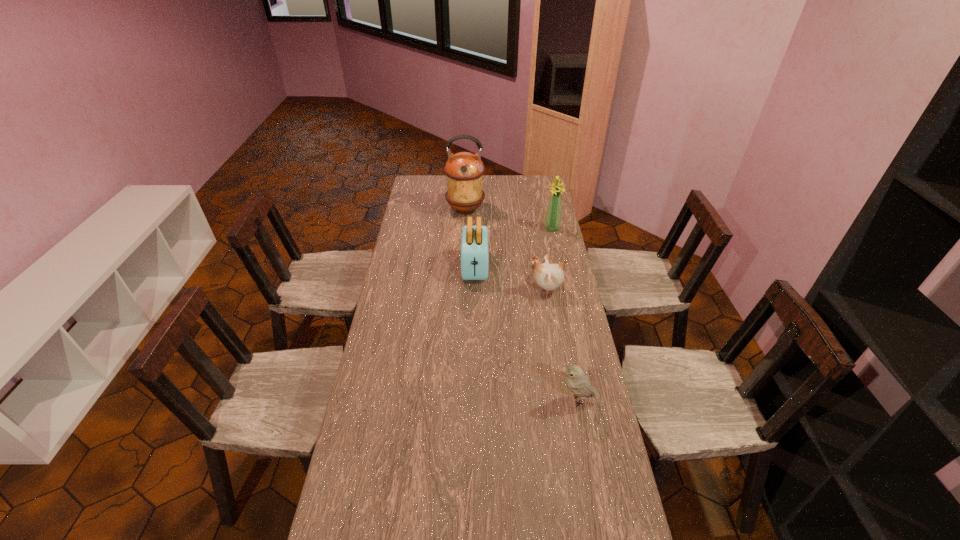
Where is `oil lamp`? oil lamp is located at coordinates (464, 170).

Where is `the tallest object`? The image size is (960, 540). the tallest object is located at coordinates (464, 170).

The image size is (960, 540). In order to click on the fourth nearest object in this screenshot , I will do `click(552, 223)`.

Where is `toaster`? The height and width of the screenshot is (540, 960). toaster is located at coordinates (474, 241).

Locate an element on the screen. This screenshot has width=960, height=540. the farther bird is located at coordinates (548, 276).

Where is `the nearer bird`? the nearer bird is located at coordinates (578, 383).

Locate an element on the screen. vacant space located 0.260m on the front of the farthest object is located at coordinates (464, 252).

Identify the location of free space located on the front-facing side of the bouquet. This screenshot has width=960, height=540. (557, 249).

Where is `free space located on the side of the third shortest object with the lever`? The height and width of the screenshot is (540, 960). free space located on the side of the third shortest object with the lever is located at coordinates (474, 303).

The height and width of the screenshot is (540, 960). I want to click on free spot located at the beak of the farther bird, so click(510, 291).